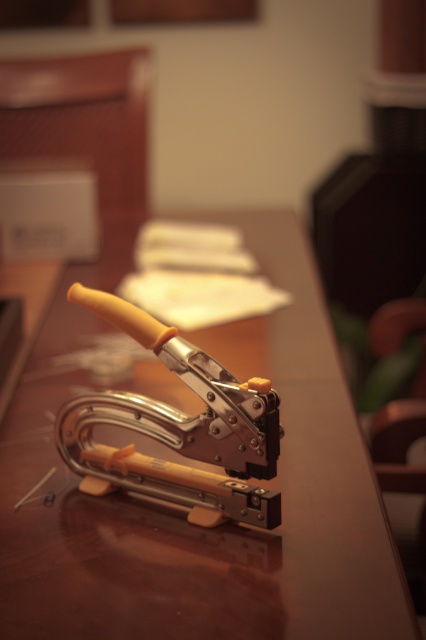
Between point (281, 376) and point (103, 456), which one is positioned behind?

Positioned behind is point (281, 376).

Who is more forward, (x=284, y=417) or (x=106, y=451)?

Point (x=106, y=451) is more forward.

This screenshot has height=640, width=426. In order to click on brown wooden table at center in this screenshot , I will do `click(221, 524)`.

You are a GUI agent. You are given a task and a screenshot of the screen. Output one action in this format:
    pyautogui.click(x=<x>, y=<y>)
    Task: Click on the brown wooden table at center
    
    Given the screenshot: What is the action you would take?
    pyautogui.click(x=221, y=524)